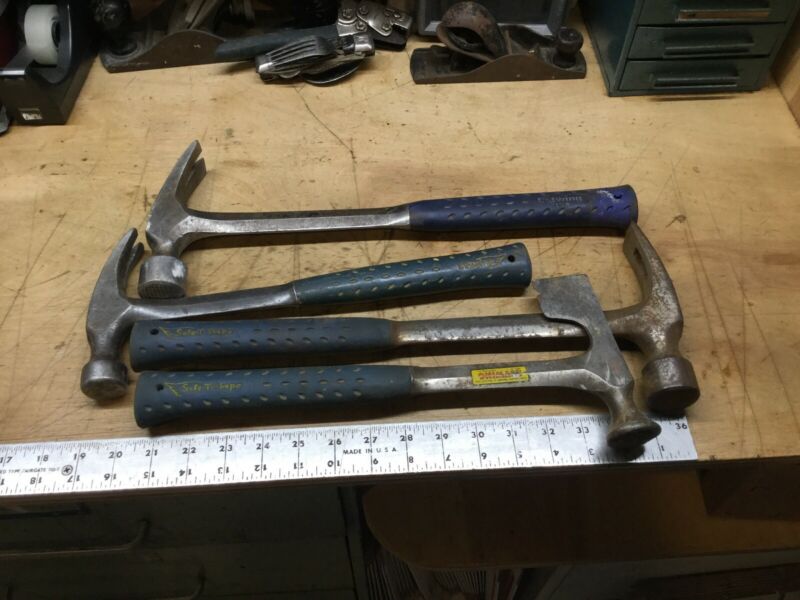
Image resolution: width=800 pixels, height=600 pixels. I want to click on drawer, so click(x=198, y=528).